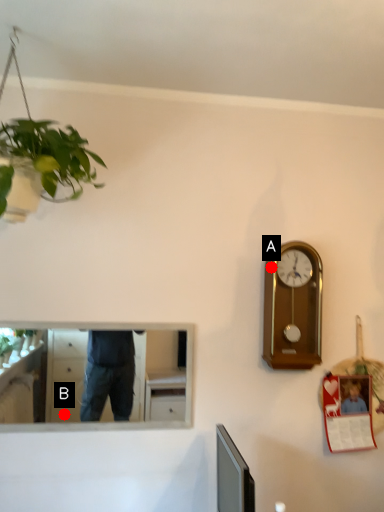
Question: Two points are circled on the image, labeled by A and B beside each circle. Which point appears farthest from the camera in this image?

Choices:
 (A) A is further
 (B) B is further

Answer: (B)